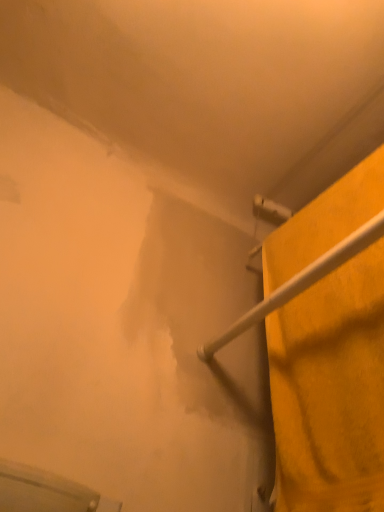
What is the approximate height of yellow fabric towel at right?

It is 61.32 centimeters.

The image size is (384, 512). Find the location of `yellow fabric towel at right`. yellow fabric towel at right is located at coordinates (330, 390).

The image size is (384, 512). What do you see at coordinates (330, 390) in the screenshot?
I see `yellow fabric towel at right` at bounding box center [330, 390].

This screenshot has width=384, height=512. I want to click on yellow fabric towel at right, so click(x=330, y=390).